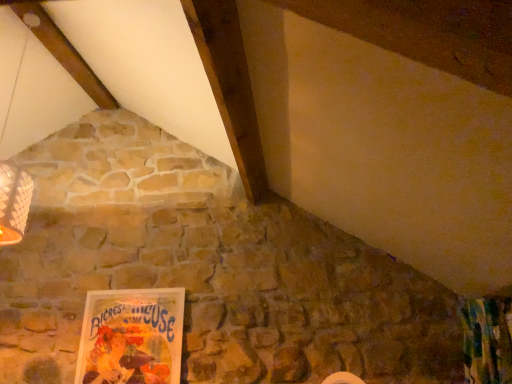
Question: Can you confirm if matte paper poster at lower left is positioned to the left of textured green curtain at lower right?

Choices:
 (A) no
 (B) yes

Answer: (B)

Question: Considering the relative sizes of matte paper poster at lower left and textured green curtain at lower right in the image provided, is matte paper poster at lower left bigger than textured green curtain at lower right?

Choices:
 (A) no
 (B) yes

Answer: (A)

Question: Does matte paper poster at lower left have a greater width compared to textured green curtain at lower right?

Choices:
 (A) no
 (B) yes

Answer: (A)

Question: Considering the relative sizes of matte paper poster at lower left and textured green curtain at lower right in the image provided, is matte paper poster at lower left smaller than textured green curtain at lower right?

Choices:
 (A) yes
 (B) no

Answer: (A)

Question: Does matte paper poster at lower left have a lesser height compared to textured green curtain at lower right?

Choices:
 (A) no
 (B) yes

Answer: (A)

Question: From a real-world perspective, does matte paper poster at lower left sit lower than textured green curtain at lower right?

Choices:
 (A) yes
 (B) no

Answer: (B)

Question: From the image's perspective, is textured green curtain at lower right over matte paper poster at lower left?

Choices:
 (A) no
 (B) yes

Answer: (B)

Question: Considering the relative sizes of textured green curtain at lower right and matte paper poster at lower left in the image provided, is textured green curtain at lower right wider than matte paper poster at lower left?

Choices:
 (A) no
 (B) yes

Answer: (B)

Question: Is textured green curtain at lower right facing away from matte paper poster at lower left?

Choices:
 (A) no
 (B) yes

Answer: (A)

Question: From a real-world perspective, is textured green curtain at lower right beneath matte paper poster at lower left?

Choices:
 (A) no
 (B) yes

Answer: (B)

Question: Is textured green curtain at lower right directly adjacent to matte paper poster at lower left?

Choices:
 (A) no
 (B) yes

Answer: (A)

Question: Does textured green curtain at lower right have a greater height compared to matte paper poster at lower left?

Choices:
 (A) no
 (B) yes

Answer: (A)

Question: Is matte paper poster at lower left situated inside textured green curtain at lower right or outside?

Choices:
 (A) outside
 (B) inside

Answer: (A)